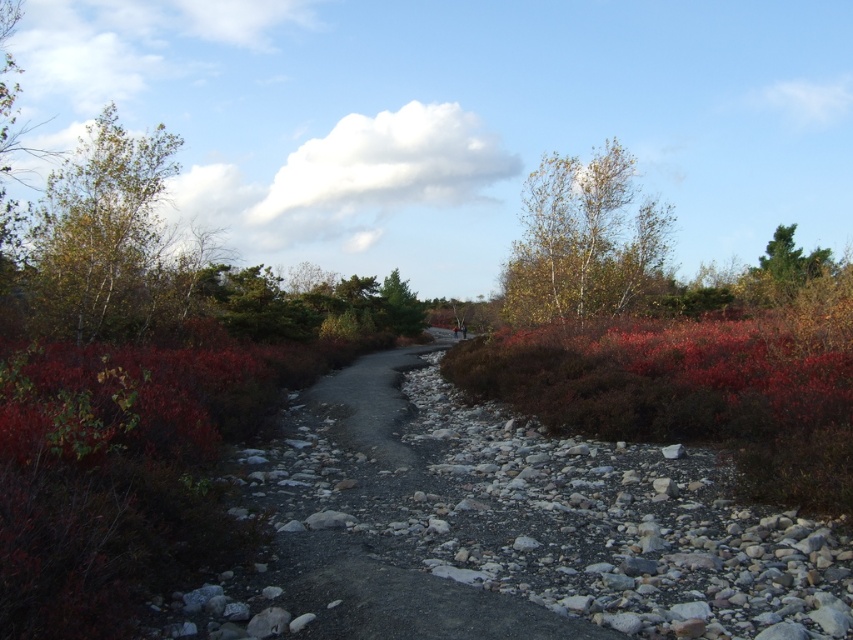
You are a hiker planning to walk along the narrow dirt path in the image. You notice the green leafy tree at upper left and the green matte tree at center. Which tree would block your view of the other tree if you were standing at the starting point of the path?

The green leafy tree at upper left is in front of the green matte tree at center, so it would block your view of the green matte tree at center.